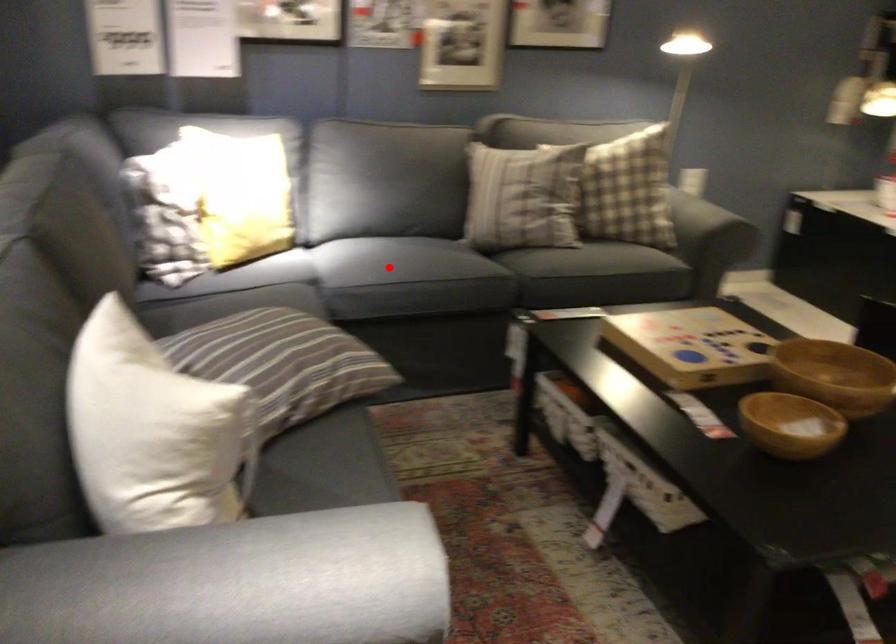
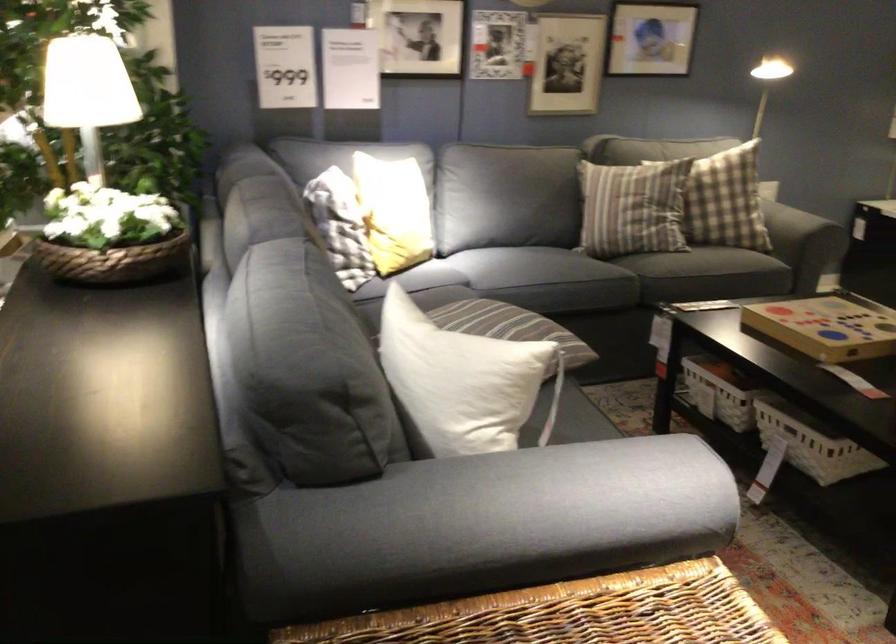
Question: I am providing you with two images of the same scene from different viewpoints. In image1, a red point is highlighted. Considering the same 3D point in image2, which of the following is correct?

Choices:
 (A) It is closer
 (B) It is farther

Answer: (B)